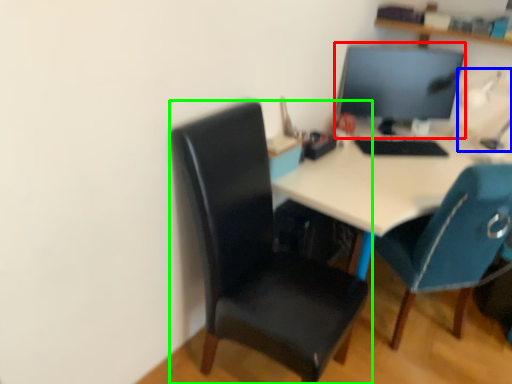
Question: Considering the real-world distances, which object is farthest from computer monitor (highlighted by a red box)? table lamp (highlighted by a blue box) or chair (highlighted by a green box)?

Choices:
 (A) table lamp
 (B) chair

Answer: (B)